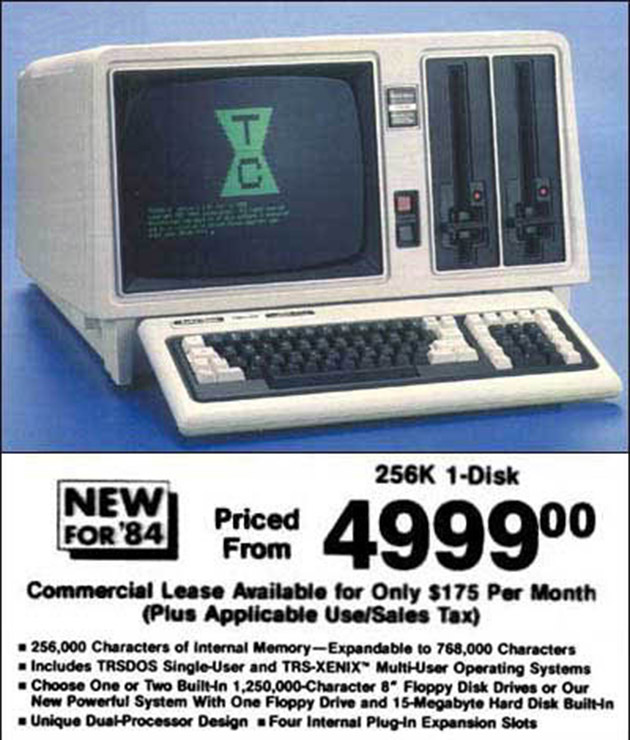
Where is `keyboard`? This screenshot has width=630, height=740. keyboard is located at coordinates (488, 352).